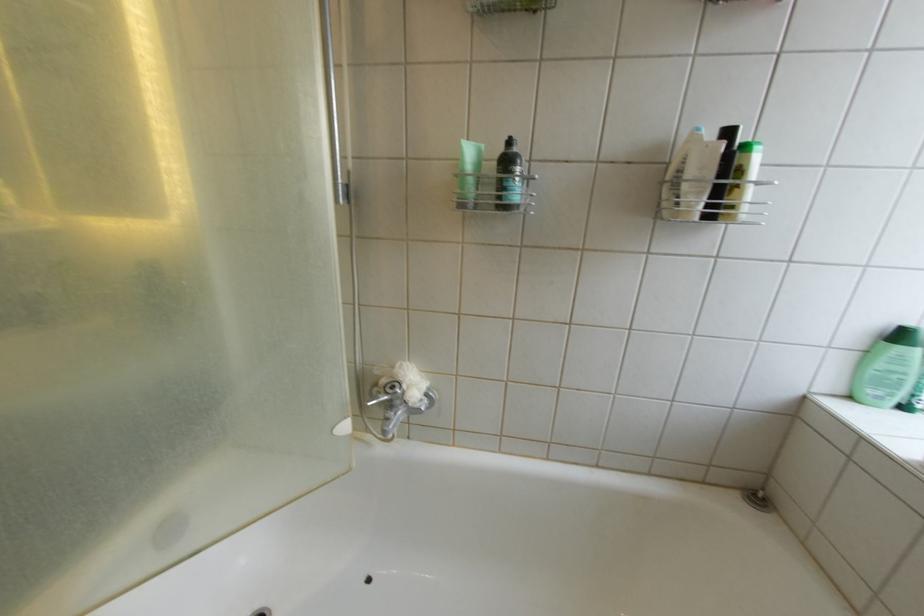
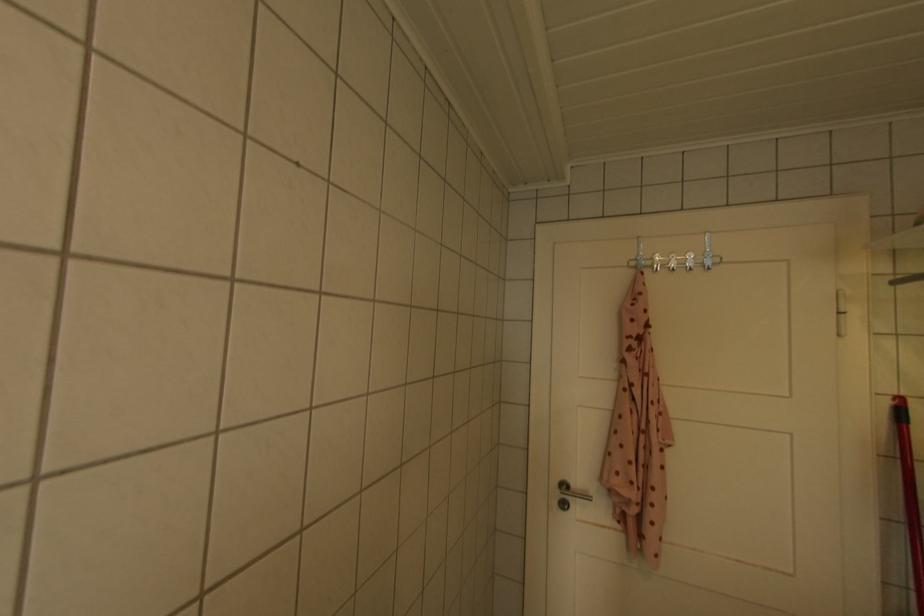
Question: How did the camera likely rotate?

Choices:
 (A) Left
 (B) Right
 (C) Up
 (D) Down

Answer: (A)